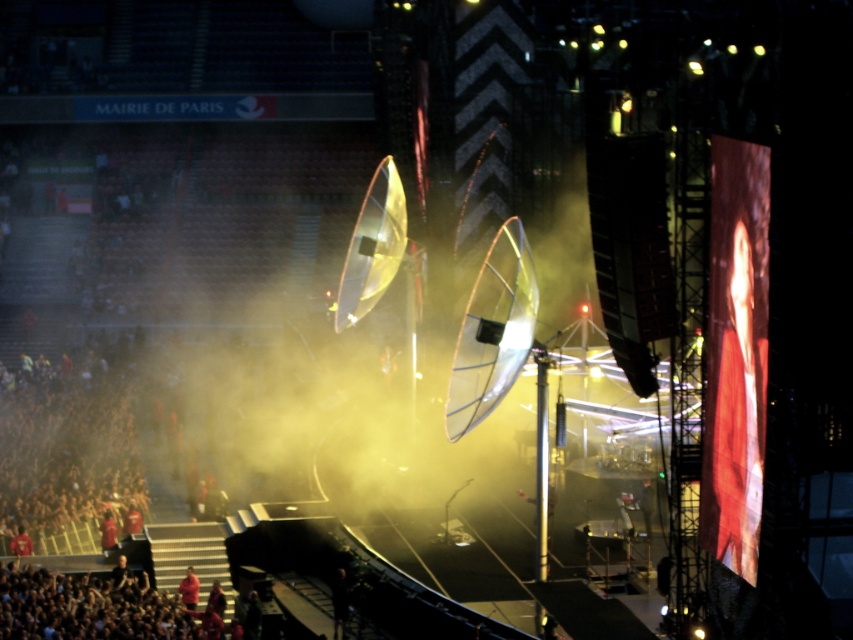
You are a stage designer planning to add a new visual element to the concert stage. You have two options for placement based on the current setup. The first option is to place a large LED screen where the red fabric crowd at lower left is currently located. The second option is to place it where the matte red shirt at center is. Considering the size of the existing elements, which location would allow the LED screen to be more visible to the audience in the upper seating area?

The red fabric crowd at lower left is smaller than the matte red shirt at center, so placing the LED screen where the matte red shirt at center is located would provide a larger space and thus better visibility for the audience in the upper seating area.

You are a stagehand at the concert and you need to place a new spotlight. The coordinates given are point [86,608]. Based on the scene description, where would this point be located?

Point [86,608] corresponds to the red fabric crowd at lower left.

You are standing at the center of the arena and want to move towards the red fabric crowd at lower left. Based on their position, which direction should you head?

The red fabric crowd at lower left is located at point [86,608], so you should head towards the lower left direction from the center of the arena.